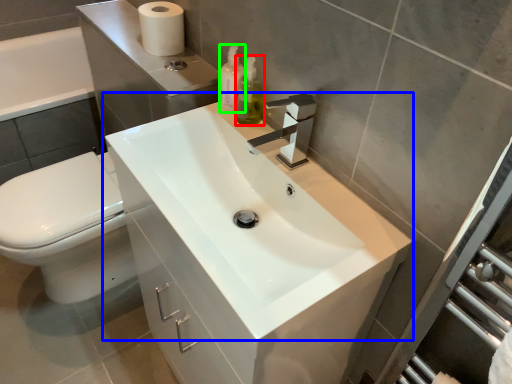
Question: Which object is positioned closest to soap dispenser (highlighted by a red box)? Select from sink (highlighted by a blue box) and soap dispenser (highlighted by a green box).

Choices:
 (A) sink
 (B) soap dispenser

Answer: (B)